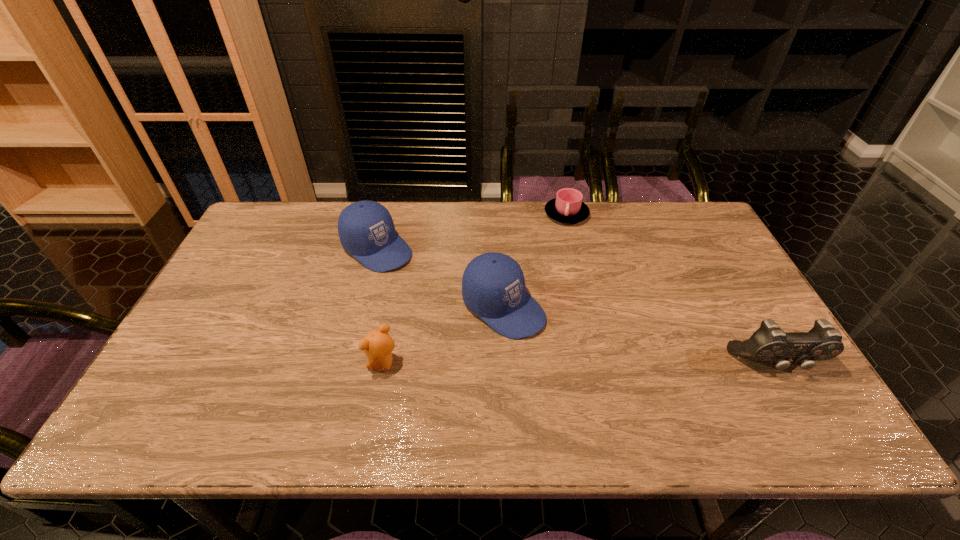
The image size is (960, 540). I want to click on vacant area that lies between the fourth object from left to right and the farther cap, so click(x=471, y=231).

The height and width of the screenshot is (540, 960). In order to click on free space between the control and the nearer cap in this screenshot , I will do `click(639, 335)`.

I want to click on the fourth closest object to the left cap, so click(x=769, y=343).

Select which object appears as the closest to the teddy bear. Please provide its 2D coordinates. Your answer should be formatted as a tuple, i.e. [(x, y)], where the tuple contains the x and y coordinates of a point satisfying the conditions above.

[(493, 286)]

Where is `vacant area that satisfies the following two spatial constraints: 1. on the front side of the nearer cap; 2. on the left side of the farther cap`? The height and width of the screenshot is (540, 960). vacant area that satisfies the following two spatial constraints: 1. on the front side of the nearer cap; 2. on the left side of the farther cap is located at coordinates (362, 307).